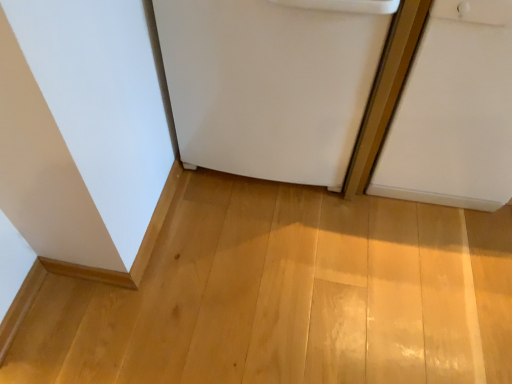
Question: From the image's perspective, is white matte door at right under white matte refrigerator at center?

Choices:
 (A) no
 (B) yes

Answer: (B)

Question: Is white matte door at right closer to the viewer compared to white matte refrigerator at center?

Choices:
 (A) yes
 (B) no

Answer: (A)

Question: Does white matte door at right have a lesser width compared to white matte refrigerator at center?

Choices:
 (A) no
 (B) yes

Answer: (B)

Question: Does white matte door at right have a greater width compared to white matte refrigerator at center?

Choices:
 (A) no
 (B) yes

Answer: (A)

Question: From a real-world perspective, is white matte door at right beneath white matte refrigerator at center?

Choices:
 (A) no
 (B) yes

Answer: (B)

Question: Can you confirm if white matte door at right is bigger than white matte refrigerator at center?

Choices:
 (A) no
 (B) yes

Answer: (A)

Question: Is white matte refrigerator at center positioned far away from white matte door at right?

Choices:
 (A) no
 (B) yes

Answer: (A)

Question: Does white matte refrigerator at center have a smaller size compared to white matte door at right?

Choices:
 (A) yes
 (B) no

Answer: (B)

Question: From the image's perspective, is white matte refrigerator at center below white matte door at right?

Choices:
 (A) no
 (B) yes

Answer: (A)

Question: Is white matte refrigerator at center at the right side of white matte door at right?

Choices:
 (A) yes
 (B) no

Answer: (B)

Question: From the image's perspective, is white matte refrigerator at center on white matte door at right?

Choices:
 (A) no
 (B) yes

Answer: (B)

Question: From a real-world perspective, is white matte refrigerator at center on top of white matte door at right?

Choices:
 (A) no
 (B) yes

Answer: (B)

Question: In terms of width, does white matte door at right look wider or thinner when compared to white matte refrigerator at center?

Choices:
 (A) wide
 (B) thin

Answer: (B)